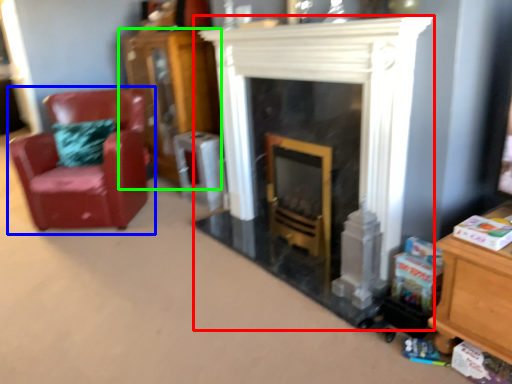
Question: Estimate the real-world distances between objects in this image. Which object is farther from fireplace (highlighted by a red box), chair (highlighted by a blue box) or dresser (highlighted by a green box)?

Choices:
 (A) chair
 (B) dresser

Answer: (B)